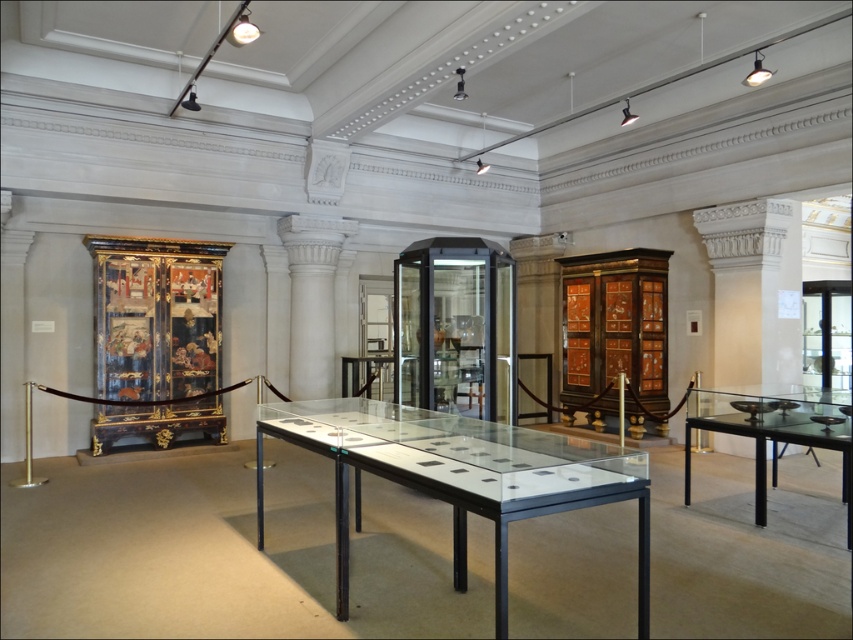
You are an event planner setting up for a presentation. You need to place a projector on the clear glass table at center and a screen on the black glass table at right. Based on the scene description, can you confirm if the screen will be positioned above the projector?

The clear glass table at center is located below the black glass table at right, so yes, placing the screen on the black glass table at right will position it above the projector on the clear glass table at center.

Looking at this image, you are standing in the museum and want to take a photo of the point at coordinates (x=318, y=412). The camera you have can focus on objects within 10 feet. Will the camera be able to capture the point clearly?

The distance between the point at coordinates (x=318, y=412) and the viewer is 15.71 feet, which exceeds the camera focus range of 10 feet. Therefore, the camera will not be able to capture the point clearly.

You are standing in front of the clear glass table at center in the museum. You want to place a sculpture that is 10 feet long on the table. Can the sculpture fit on the table? Please explain your reasoning.

The clear glass table at center is 8.53 feet away from the camera, but the distance from the camera does not indicate the table length. The problem cannot be solved with the given information.